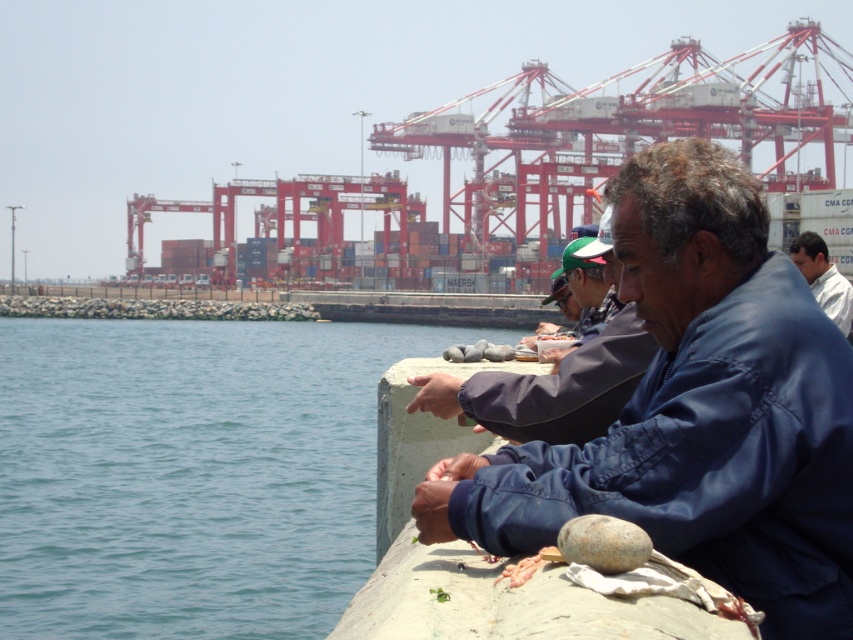
Which is behind, point (248, 572) or point (686, 420)?

Positioned behind is point (248, 572).

Does point (207, 625) come farther from viewer compared to point (808, 307)?

Yes.

This screenshot has height=640, width=853. I want to click on blue water at lower left, so click(190, 472).

Find the location of a particular element. The width and height of the screenshot is (853, 640). blue fabric jacket at center is located at coordinates (697, 412).

Does point (601, 460) come farther from viewer compared to point (828, 300)?

No, (601, 460) is in front of (828, 300).

Locate an element on the screen. blue fabric jacket at center is located at coordinates (697, 412).

Which is in front, point (142, 392) or point (844, 288)?

Positioned in front is point (844, 288).

Describe the element at coordinates (190, 472) in the screenshot. I see `blue water at lower left` at that location.

Is point (131, 346) closer to viewer compared to point (809, 262)?

That is False.

This screenshot has width=853, height=640. In order to click on blue water at lower left in this screenshot , I will do `click(190, 472)`.